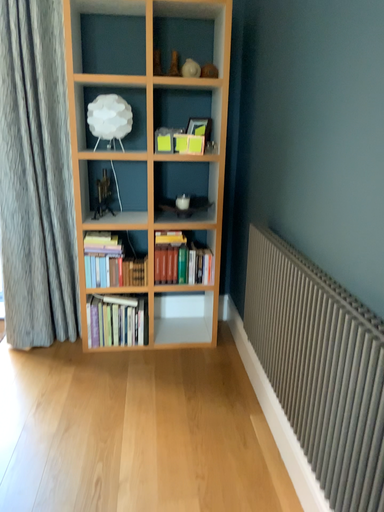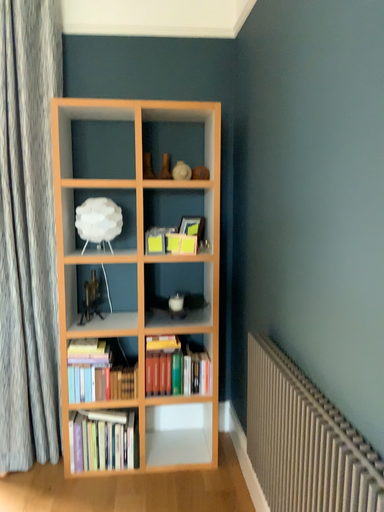
Question: How did the camera likely rotate when shooting the video?

Choices:
 (A) rotated downward
 (B) rotated upward

Answer: (B)